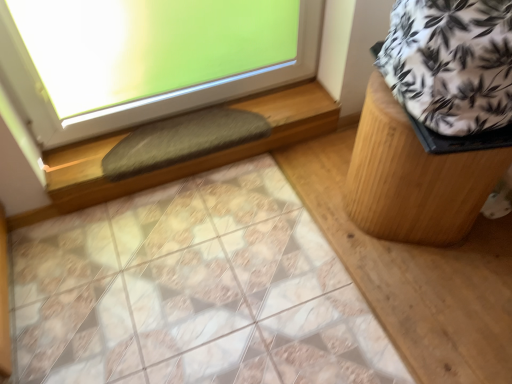
Question: Based on their sizes in the image, would you say green felt at upper left is bigger or smaller than gray fuzzy mat at lower center?

Choices:
 (A) small
 (B) big

Answer: (B)

Question: In the image, is green felt at upper left on the left side or the right side of gray fuzzy mat at lower center?

Choices:
 (A) right
 (B) left

Answer: (A)

Question: Estimate the real-world distances between objects in this image. Which object is farther from the white printed fabric at upper right?

Choices:
 (A) wooden stool at right
 (B) gray fuzzy mat at lower center
 (C) green felt at upper left

Answer: (C)

Question: Based on their relative distances, which object is nearer to the gray fuzzy mat at lower center?

Choices:
 (A) green felt at upper left
 (B) white printed fabric at upper right
 (C) wooden stool at right

Answer: (A)